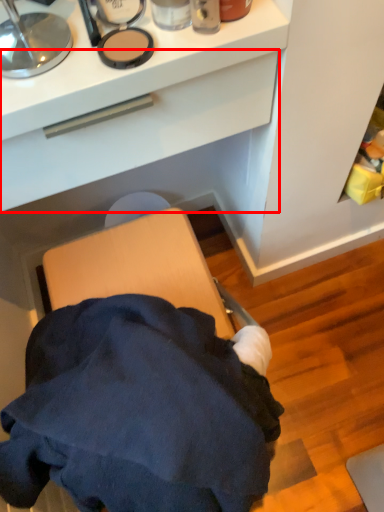
Question: From the image's perspective, where is drawer (annotated by the red box) located relative to toiletry?

Choices:
 (A) below
 (B) above

Answer: (A)